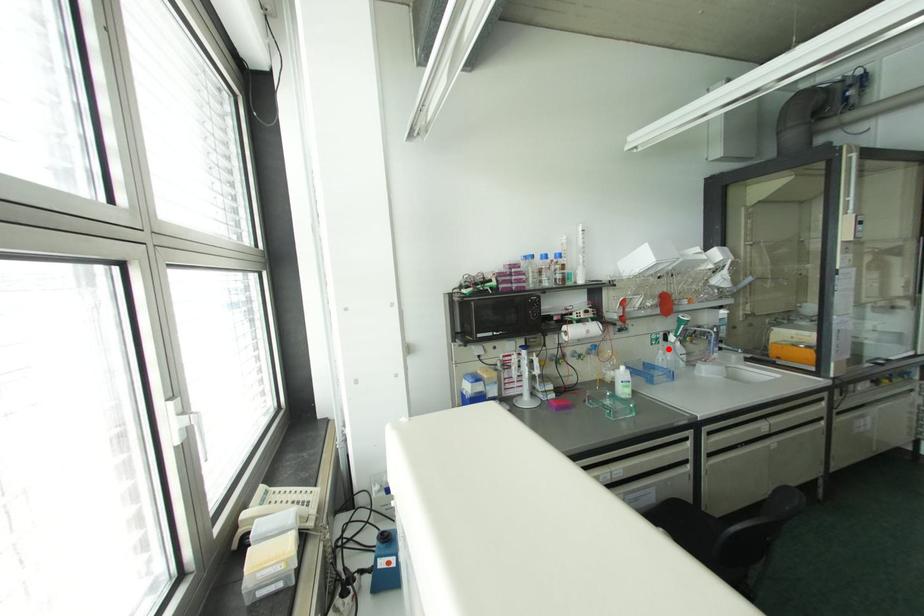
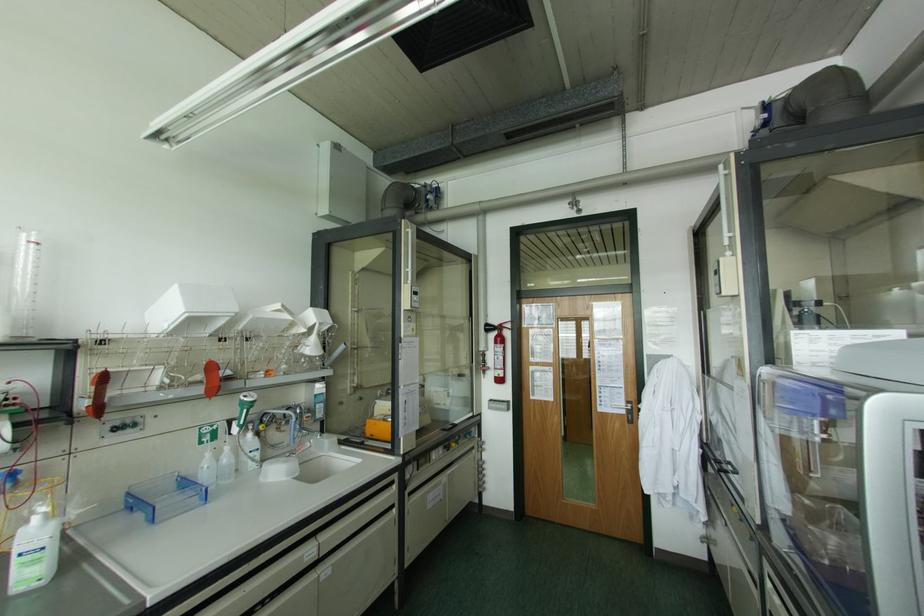
Locate, in the second image, the point that corresponds to the highlighted location in the first image.

(226, 448)